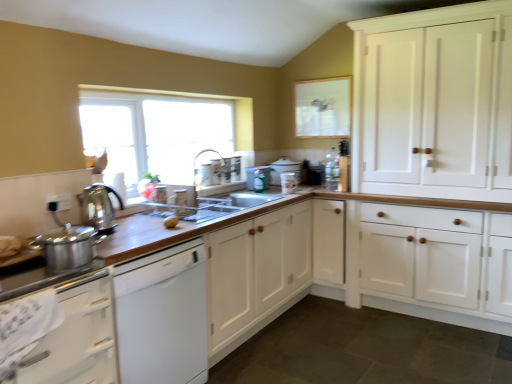
The image size is (512, 384). Find the location of `spots to the right of matte white mug at upper center, which is the fourth appliance in back-to-front order`. spots to the right of matte white mug at upper center, which is the fourth appliance in back-to-front order is located at coordinates (309, 187).